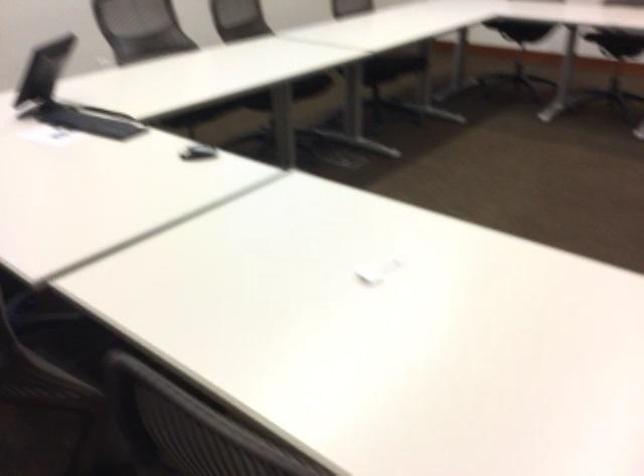
This screenshot has width=644, height=476. Describe the element at coordinates (89, 120) in the screenshot. I see `the laptop keyboard` at that location.